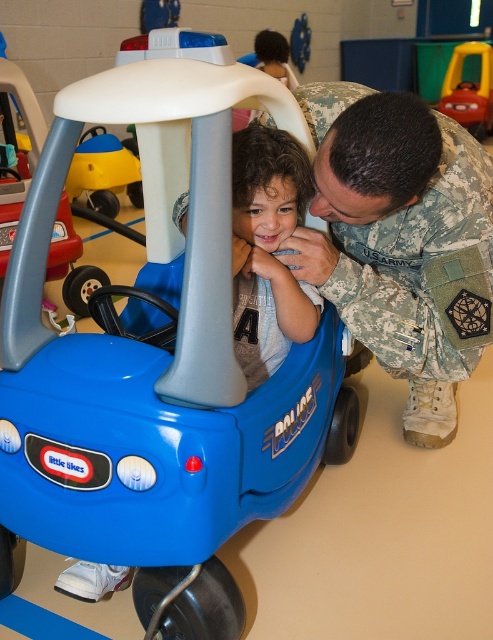
Does blue plastic toy car at center appear on the right side of camouflage uniform at center?

In fact, blue plastic toy car at center is to the left of camouflage uniform at center.

Can you confirm if blue plastic toy car at center is wider than camouflage uniform at center?

Yes, blue plastic toy car at center is wider than camouflage uniform at center.

Measure the distance between blue plastic toy car at center and camera.

1.00 meters

This screenshot has height=640, width=493. I want to click on blue plastic toy car at center, so click(159, 364).

Can you confirm if blue plastic toy car at center is shorter than matte yellow toy car at left?

Incorrect, blue plastic toy car at center's height does not fall short of matte yellow toy car at left's.

Is blue plastic toy car at center thinner than matte yellow toy car at left?

No.

Which is behind, point (154, 353) or point (124, 148)?

The point (124, 148) is more distant.

Identify the location of blue plastic toy car at center. (159, 364).

Describe the element at coordinates (400, 241) in the screenshot. The image size is (493, 640). I see `camouflage uniform at center` at that location.

At what (x,y) coordinates should I click in order to perform the action: click on camouflage uniform at center. Please return your answer as a coordinate pair (x, y). This screenshot has width=493, height=640. Looking at the image, I should click on (400, 241).